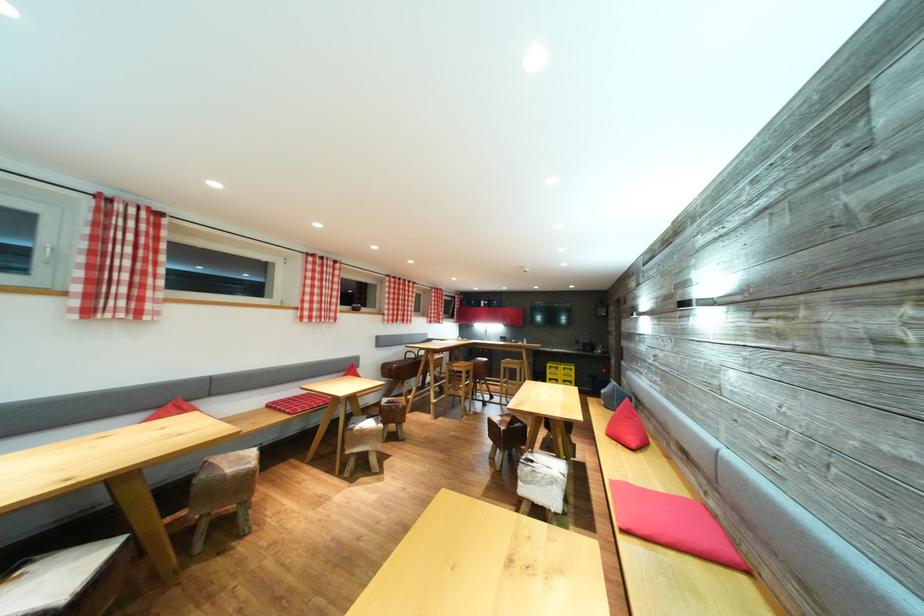
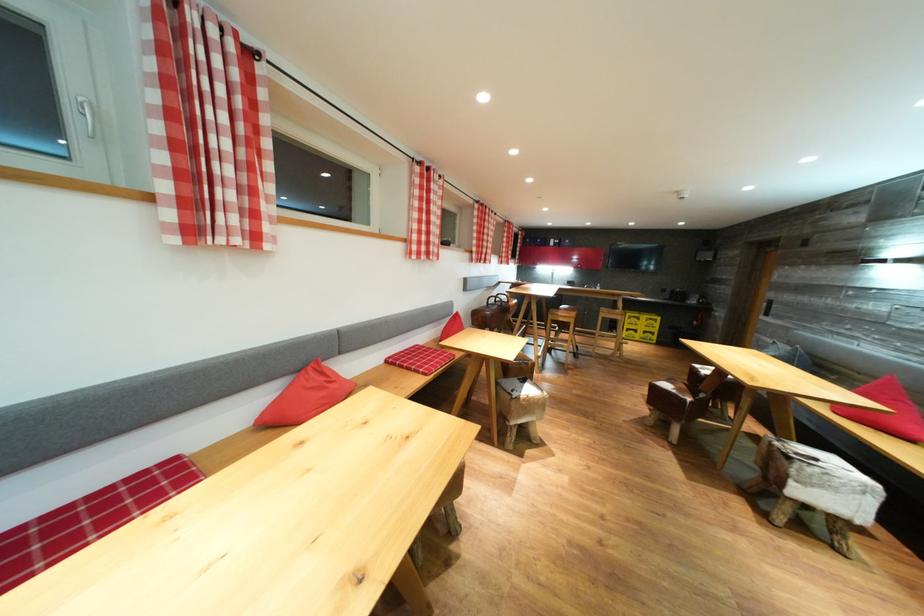
The point at (540,467) is marked in the first image. Where is the corresponding point in the second image?

(821, 464)